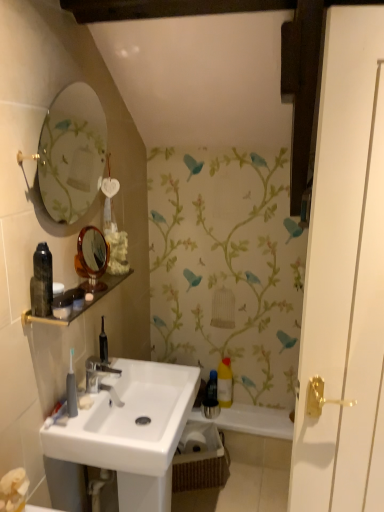
Find the location of a particular element. The height and width of the screenshot is (512, 384). vacant area that is situated to the right of yellow plastic bottle at center is located at coordinates (260, 410).